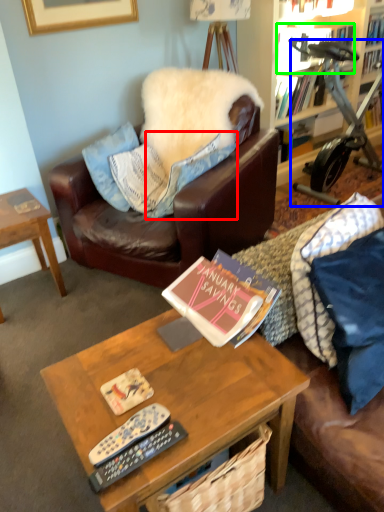
Question: Based on their relative distances, which object is farther from pillow (highlighted by a red box)? Choose from stationary bicycle (highlighted by a blue box) and book (highlighted by a green box).

Choices:
 (A) stationary bicycle
 (B) book

Answer: (B)